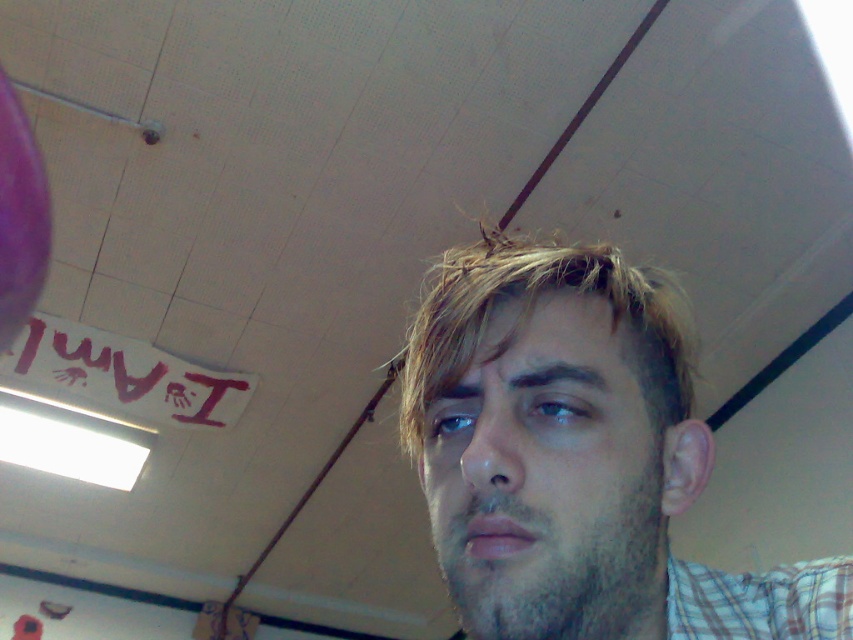
Between light brown hair at center and handprint graffiti at upper left, which one appears on the left side from the viewer's perspective?

handprint graffiti at upper left

Identify the location of light brown hair at center. The image size is (853, 640). (550, 438).

Identify the location of light brown hair at center. The width and height of the screenshot is (853, 640). (550, 438).

Does handprint graffiti at upper left appear on the left side of plaid fabric at lower right?

Correct, you'll find handprint graffiti at upper left to the left of plaid fabric at lower right.

Where is `handprint graffiti at upper left`? The width and height of the screenshot is (853, 640). handprint graffiti at upper left is located at coordinates (123, 376).

Measure the distance between light brown hair at center and plaid fabric at lower right.

The distance of light brown hair at center from plaid fabric at lower right is 3.02 inches.

Based on the photo, is light brown hair at center in front of plaid fabric at lower right?

Yes, it is.

Who is more forward, (563, 557) or (801, 595)?

Point (563, 557)

You are a GUI agent. You are given a task and a screenshot of the screen. Output one action in this format:
    pyautogui.click(x=<x>, y=<y>)
    Task: Click on the light brown hair at center
    
    Given the screenshot: What is the action you would take?
    click(550, 438)